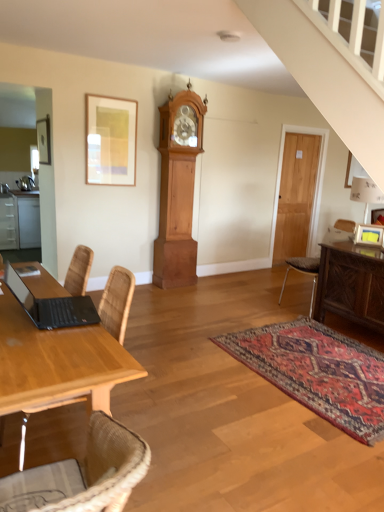
Image resolution: width=384 pixels, height=512 pixels. Describe the element at coordinates (296, 195) in the screenshot. I see `wooden door at right` at that location.

The image size is (384, 512). Describe the element at coordinates (304, 273) in the screenshot. I see `brown leather chair at right` at that location.

Locate an element on the screen. This screenshot has width=384, height=512. black matte laptop at lower left is located at coordinates tap(51, 305).

This screenshot has height=512, width=384. What do you see at coordinates (111, 140) in the screenshot?
I see `matte gold picture frame at upper left` at bounding box center [111, 140].

This screenshot has height=512, width=384. In order to click on wooden door at right in this screenshot , I will do `click(296, 195)`.

Measure the distance between satin white cabinets at left and wooden door at right.

satin white cabinets at left and wooden door at right are 13.06 feet apart.

From the picture: From a real-world perspective, is satin white cabinets at left under wooden door at right?

Correct, in the physical world, satin white cabinets at left is lower than wooden door at right.

Is satin white cabinets at left wider or thinner than wooden door at right?

satin white cabinets at left is wider than wooden door at right.

From a real-world perspective, which is physically below, satin white cabinets at left or carved wood sideboard at right?

From a 3D spatial view, satin white cabinets at left is below.

Considering the positions of objects satin white cabinets at left and carved wood sideboard at right in the image provided, who is more to the right, satin white cabinets at left or carved wood sideboard at right?

From the viewer's perspective, carved wood sideboard at right appears more on the right side.

Consider the image. Is satin white cabinets at left facing away from carved wood sideboard at right?

No, satin white cabinets at left's orientation is not away from carved wood sideboard at right.

Can you tell me how much satin white cabinets at left and carved wood sideboard at right differ in facing direction?

There is a 91.8-degree angle between the facing directions of satin white cabinets at left and carved wood sideboard at right.

Which is behind, point (119, 369) or point (330, 239)?

Positioned behind is point (330, 239).

Which object is positioned more to the left, wooden table at left or carved wood sideboard at right?

Positioned to the left is wooden table at left.

Is wooden table at left bigger than carved wood sideboard at right?

Correct, wooden table at left is larger in size than carved wood sideboard at right.

Is point (127, 319) less distant than point (77, 323)?

No, it is behind (77, 323).

Looking at the image, does wooden table at left seem bigger or smaller compared to black matte laptop at lower left?

Clearly, wooden table at left is larger in size than black matte laptop at lower left.

Considering the sizes of wooden table at left and black matte laptop at lower left in the image, is wooden table at left wider or thinner than black matte laptop at lower left?

Considering their sizes, wooden table at left looks broader than black matte laptop at lower left.

Is wooden table at left facing away from black matte laptop at lower left?

No, black matte laptop at lower left is not at the back of wooden table at left.

Is brown leather chair at right not inside matte gold picture frame at upper left?

Yes, brown leather chair at right is outside of matte gold picture frame at upper left.

Is brown leather chair at right smaller than matte gold picture frame at upper left?

No, brown leather chair at right is not smaller than matte gold picture frame at upper left.

From a real-world perspective, is brown leather chair at right physically located above or below matte gold picture frame at upper left?

In terms of real-world spatial position, brown leather chair at right is below matte gold picture frame at upper left.

You are a GUI agent. You are given a task and a screenshot of the screen. Output one action in this format:
    pyautogui.click(x=<x>, y=<y>)
    Task: Click on the picture frame that appears above the brown leather chair at right (from a real-world perspective)
    The image size is (384, 512).
    Given the screenshot: What is the action you would take?
    pyautogui.click(x=111, y=140)

Can you confirm if matte gold picture frame at upper left is bigger than brown leather chair at right?

No.

Is matte gold picture frame at upper left oriented away from brown leather chair at right?

matte gold picture frame at upper left is not turned away from brown leather chair at right.

Based on the photo, how much distance is there between matte gold picture frame at upper left and brown leather chair at right?

2.20 meters.

Is wooden door at right completely or partially outside of satin white cabinets at left?

Absolutely, wooden door at right is external to satin white cabinets at left.

From the image's perspective, who appears lower, wooden door at right or satin white cabinets at left?

satin white cabinets at left.

Considering the sizes of objects wooden door at right and satin white cabinets at left in the image provided, who is thinner, wooden door at right or satin white cabinets at left?

wooden door at right.

Where is `glass door that appears above the satin white cabinets at left (from the image's perspective)`? The height and width of the screenshot is (512, 384). glass door that appears above the satin white cabinets at left (from the image's perspective) is located at coordinates (296, 195).

Locate an element on the screen. The width and height of the screenshot is (384, 512). table above the satin white cabinets at left (from a real-world perspective) is located at coordinates (351, 283).

In the scene shown: Looking at the image, which one is located closer to brown leather chair at right, wooden table at left or black matte laptop at lower left?

black matte laptop at lower left.

When comparing their distances from matte gold picture frame at upper left, does carved wood sideboard at right or black matte laptop at lower left seem further?

Based on the image, carved wood sideboard at right appears to be further to matte gold picture frame at upper left.

Looking at the image, which one is located further to brown leather chair at right, matte gold picture frame at upper left or wooden door at right?

matte gold picture frame at upper left.

When comparing their distances from satin white cabinets at left, does wooden table at left or black matte laptop at lower left seem further?

wooden table at left lies further to satin white cabinets at left than the other object.

From the image, which object appears to be farther from matte gold picture frame at upper left, carved wood sideboard at right or satin white cabinets at left?

Among the two, satin white cabinets at left is located further to matte gold picture frame at upper left.

Estimate the real-world distances between objects in this image. Which object is closer to wooden table at left, satin white cabinets at left or carved wood sideboard at right?

carved wood sideboard at right lies closer to wooden table at left than the other object.

Based on their spatial positions, is satin white cabinets at left or carved wood sideboard at right further from black matte laptop at lower left?

satin white cabinets at left is positioned further to the anchor black matte laptop at lower left.

Estimate the real-world distances between objects in this image. Which object is closer to matte gold picture frame at upper left, brown leather chair at right or satin white cabinets at left?

brown leather chair at right is closer to matte gold picture frame at upper left.

I want to click on picture frame between wooden table at left and satin white cabinets at left along the z-axis, so click(111, 140).

Where is `picture frame between black matte laptop at lower left and light brown wood grandfather clock at center in the front-back direction`? The width and height of the screenshot is (384, 512). picture frame between black matte laptop at lower left and light brown wood grandfather clock at center in the front-back direction is located at coordinates (111, 140).

Where is `chair between wooden table at left and matte gold picture frame at upper left in the front-back direction`? This screenshot has height=512, width=384. chair between wooden table at left and matte gold picture frame at upper left in the front-back direction is located at coordinates (304, 273).

Locate an element on the screen. The width and height of the screenshot is (384, 512). picture frame between black matte laptop at lower left and wooden door at right from front to back is located at coordinates (111, 140).